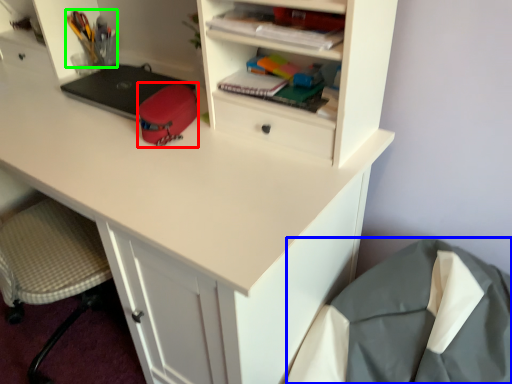
Question: Which is nearer to the stationery (highlighted by a red box)? sleeping bag (highlighted by a blue box) or stationery (highlighted by a green box).

Choices:
 (A) sleeping bag
 (B) stationery

Answer: (B)